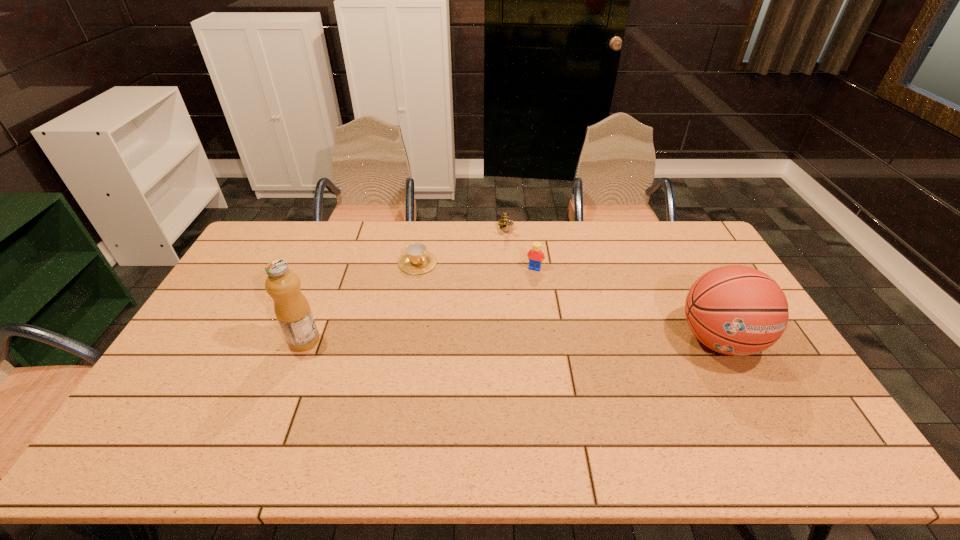
The image size is (960, 540). Identify the location of vacant space on the desktop that is between the leftmost object and the rightmost object and is positioned with the handle on the side of the shortest object. (492, 340).

What are the coordinates of `vacant space on the desktop that is between the leftmost object and the rightmost object and is positioned on the face of the Lego` in the screenshot? It's located at (504, 340).

The height and width of the screenshot is (540, 960). Find the location of `free space on the desktop that is between the leftmost object and the rightmost object and is positioned on the face of the snail`. free space on the desktop that is between the leftmost object and the rightmost object and is positioned on the face of the snail is located at coordinates (545, 340).